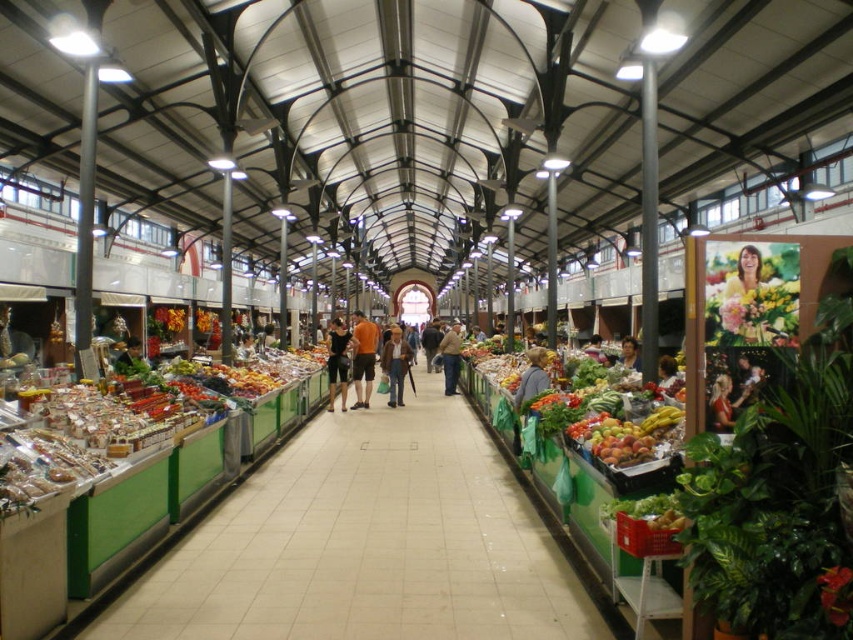
Question: Does matte black shorts at center have a lesser width compared to brown leather jacket at center?

Choices:
 (A) yes
 (B) no

Answer: (B)

Question: Is smooth yellow hair at center behind matte gray sweater at center?

Choices:
 (A) yes
 (B) no

Answer: (B)

Question: Which of these objects is positioned farthest from the orange cotton t-shirt at center?

Choices:
 (A) smooth yellow hair at center
 (B) matte black jacket at center
 (C) matte black shorts at center

Answer: (A)

Question: Which of the following is the farthest from the observer?

Choices:
 (A) (548, 385)
 (B) (361, 371)

Answer: (B)

Question: Which object appears farthest from the camera in this image?

Choices:
 (A) smooth yellow hair at center
 (B) denim jacket at center

Answer: (B)

Question: Can you confirm if green leafy vegetables at center is smaller than orange cotton t-shirt at center?

Choices:
 (A) yes
 (B) no

Answer: (A)